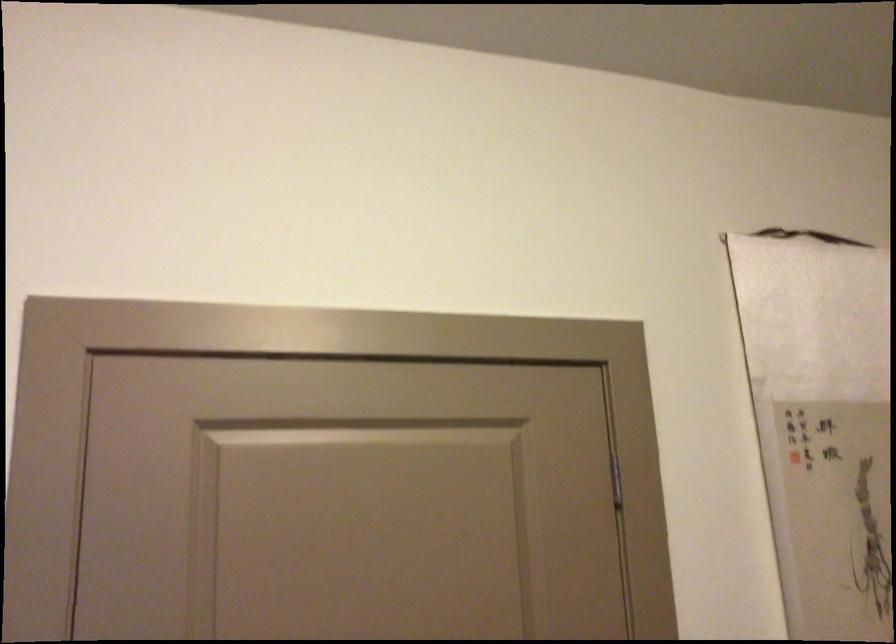
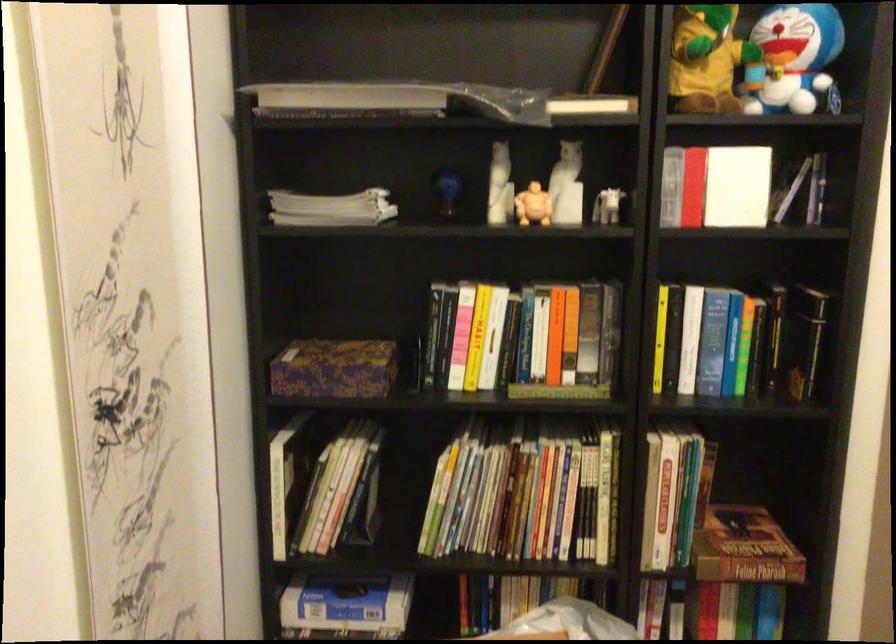
Question: The camera is either moving clockwise (left) or counter-clockwise (right) around the object. The first image is from the beginning of the video and the second image is from the end. Is the camera moving left or right when shooting the video?

Choices:
 (A) Left
 (B) Right

Answer: (A)